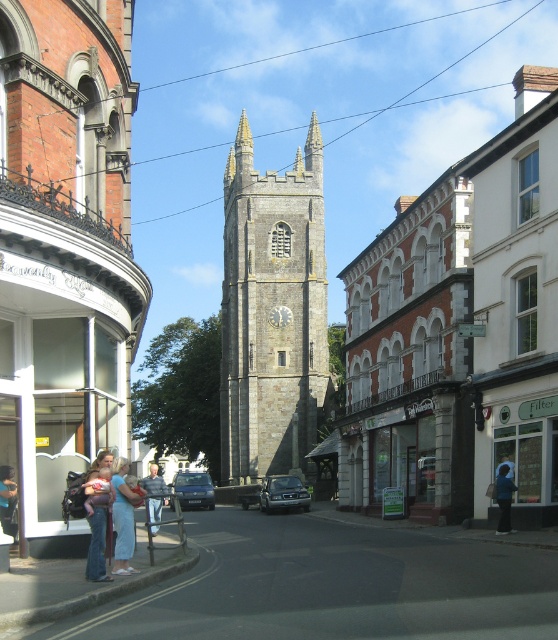
Question: Which point appears closest to the camera in this image?

Choices:
 (A) (286, 502)
 (B) (122, 499)
 (C) (1, 509)
 (D) (151, 531)

Answer: (B)

Question: Observing the image, what is the correct spatial positioning of denim jeans at lower left in reference to denim jacket at lower left?

Choices:
 (A) above
 (B) below

Answer: (A)

Question: Which is nearer to the metallic blue car at center?

Choices:
 (A) white brick church at center
 (B) denim jeans at lower left

Answer: (A)

Question: Considering the relative positions of metallic blue car at center and dark blue fabric jacket at lower right in the image provided, where is metallic blue car at center located with respect to dark blue fabric jacket at lower right?

Choices:
 (A) right
 (B) left

Answer: (B)

Question: Among these objects, which one is farthest from the camera?

Choices:
 (A) white brick church at center
 (B) blue denim jeans at center
 (C) gray stone clock tower at center
 (D) light blue fabric dress at lower left

Answer: (C)

Question: Does white brick church at center have a smaller size compared to light blue fabric dress at lower left?

Choices:
 (A) no
 (B) yes

Answer: (A)